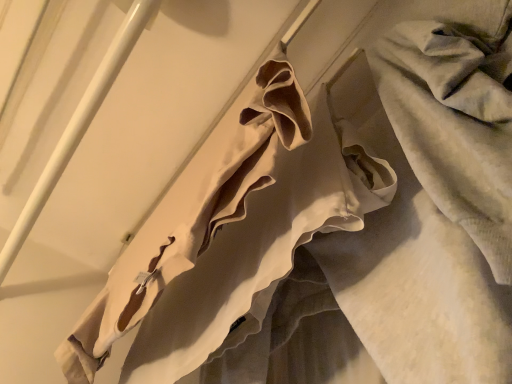
At what (x,y) coordinates should I click in order to perform the action: click on beige fabric curtain at center. Please return your answer as a coordinate pair (x, y). Image resolution: width=512 pixels, height=384 pixels. Looking at the image, I should click on (230, 232).

In order to face beige fabric curtain at center, should I rotate leftwards or rightwards?

It's best to rotate left around 4.366 degrees.

The width and height of the screenshot is (512, 384). What do you see at coordinates (230, 232) in the screenshot? I see `beige fabric curtain at center` at bounding box center [230, 232].

The width and height of the screenshot is (512, 384). I want to click on beige fabric curtain at center, so click(230, 232).